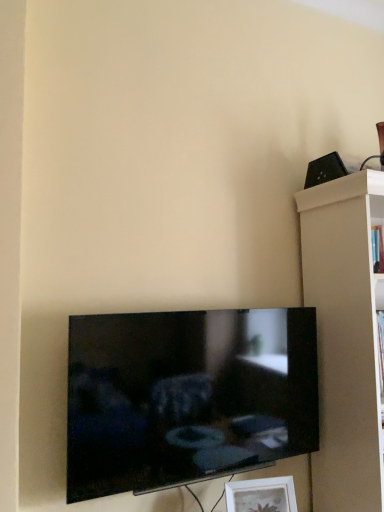
Question: Is white matte picture frame at lower center to the left of black glossy tv at lower center from the viewer's perspective?

Choices:
 (A) no
 (B) yes

Answer: (A)

Question: Is white matte picture frame at lower center wider than black glossy tv at lower center?

Choices:
 (A) yes
 (B) no

Answer: (A)

Question: Does white matte picture frame at lower center contain black glossy tv at lower center?

Choices:
 (A) no
 (B) yes

Answer: (A)

Question: Considering the relative sizes of white matte picture frame at lower center and black glossy tv at lower center in the image provided, is white matte picture frame at lower center smaller than black glossy tv at lower center?

Choices:
 (A) no
 (B) yes

Answer: (B)

Question: From the image's perspective, does white matte picture frame at lower center appear higher than black glossy tv at lower center?

Choices:
 (A) no
 (B) yes

Answer: (A)

Question: Considering their positions, is black plastic speaker at upper right located in front of or behind black glossy tv at lower center?

Choices:
 (A) behind
 (B) front

Answer: (A)

Question: From their relative heights in the image, would you say black plastic speaker at upper right is taller or shorter than black glossy tv at lower center?

Choices:
 (A) tall
 (B) short

Answer: (B)

Question: Considering the relative positions of black plastic speaker at upper right and black glossy tv at lower center in the image provided, is black plastic speaker at upper right to the left or to the right of black glossy tv at lower center?

Choices:
 (A) right
 (B) left

Answer: (A)

Question: Is black plastic speaker at upper right wider or thinner than black glossy tv at lower center?

Choices:
 (A) wide
 (B) thin

Answer: (A)

Question: Based on their sizes in the image, would you say white matte shelf at right is bigger or smaller than black plastic speaker at upper right?

Choices:
 (A) big
 (B) small

Answer: (A)

Question: Is white matte shelf at right taller or shorter than black plastic speaker at upper right?

Choices:
 (A) short
 (B) tall

Answer: (B)

Question: From a real-world perspective, is white matte shelf at right above or below black plastic speaker at upper right?

Choices:
 (A) above
 (B) below

Answer: (B)

Question: In the image, is white matte shelf at right positioned in front of or behind black plastic speaker at upper right?

Choices:
 (A) behind
 (B) front

Answer: (B)

Question: Relative to black plastic speaker at upper right, is black glossy tv at lower center in front or behind?

Choices:
 (A) front
 (B) behind

Answer: (A)

Question: Visually, is black glossy tv at lower center positioned to the left or to the right of black plastic speaker at upper right?

Choices:
 (A) left
 (B) right

Answer: (A)